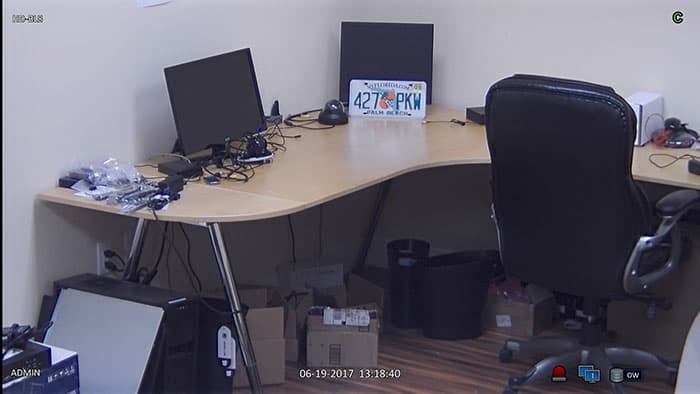
Where is `wires`? This screenshot has width=700, height=394. wires is located at coordinates (227, 152), (304, 121), (181, 259), (301, 235), (684, 152).